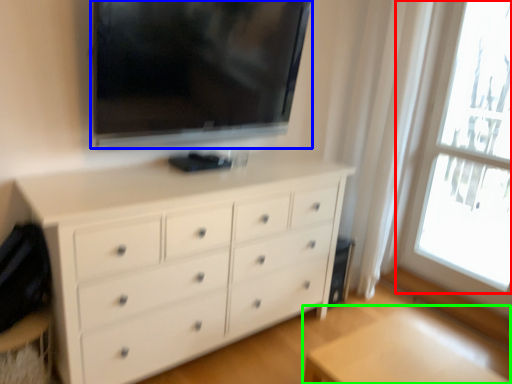
Question: Considering the real-world distances, which object is closest to window (highlighted by a red box)? television (highlighted by a blue box) or table (highlighted by a green box).

Choices:
 (A) television
 (B) table

Answer: (A)